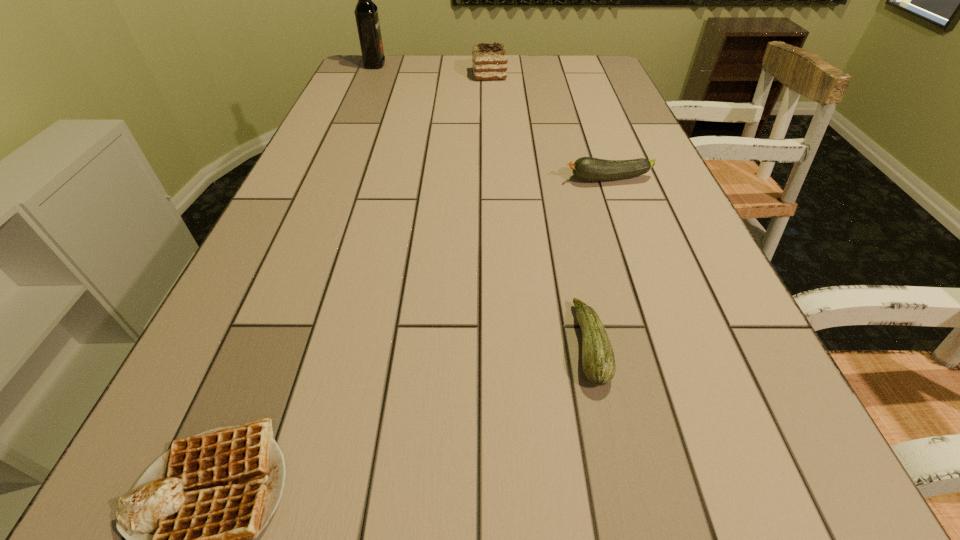
Image resolution: width=960 pixels, height=540 pixels. What are the coordinates of `vacant area at the right edge` in the screenshot? It's located at (640, 153).

In the image, there is a desktop. Identify the location of vacant space at the far right corner. This screenshot has width=960, height=540. (585, 55).

The image size is (960, 540). In order to click on vacant space in between the farther zucchini and the fourth farthest object in this screenshot , I will do `click(599, 262)`.

Where is `free spot between the farther zucchini and the tallest object`? free spot between the farther zucchini and the tallest object is located at coordinates (492, 122).

At what (x,y) coordinates should I click in order to perform the action: click on free space between the tallest object and the farther zucchini. Please return your answer as a coordinate pair (x, y). This screenshot has width=960, height=540. Looking at the image, I should click on (492, 122).

You are a GUI agent. You are given a task and a screenshot of the screen. Output one action in this format:
    pyautogui.click(x=<x>, y=<y>)
    Task: Click on the vacant point located between the tallest object and the chocolate cake
    Image resolution: width=960 pixels, height=540 pixels.
    Given the screenshot: What is the action you would take?
    pyautogui.click(x=432, y=70)

Locate an element on the screen. The width and height of the screenshot is (960, 540). vacant area between the farther zucchini and the third object from right to left is located at coordinates (549, 127).

What are the coordinates of `free spot between the chocolate cake and the third farthest object` in the screenshot? It's located at (549, 127).

Where is `object that is the third closest to the liquor`? The height and width of the screenshot is (540, 960). object that is the third closest to the liquor is located at coordinates (598, 360).

Identify which object is the second nearest to the fourth shortest object. Please provide its 2D coordinates. Your answer should be formatted as a tuple, i.e. [(x, y)], where the tuple contains the x and y coordinates of a point satisfying the conditions above.

[(586, 168)]